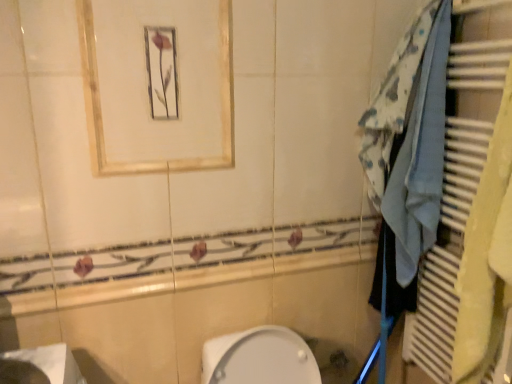
At what (x,y) coordinates should I click in order to perform the action: click on white glossy sink at lower left. Please return your answer as a coordinate pair (x, y). The height and width of the screenshot is (384, 512). Looking at the image, I should click on (49, 363).

Is point (425, 119) farther from viewer compared to point (68, 360)?

Yes, point (425, 119) is behind point (68, 360).

Can you confirm if blue fabric at right is smaller than white glossy sink at lower left?

Incorrect, blue fabric at right is not smaller in size than white glossy sink at lower left.

Considering the sizes of objects blue fabric at right and white glossy sink at lower left in the image provided, who is wider, blue fabric at right or white glossy sink at lower left?

Wider between the two is white glossy sink at lower left.

Is blue fabric towel at right facing away from matte gold frame at upper center?

No, blue fabric towel at right's orientation is not away from matte gold frame at upper center.

Are blue fabric towel at right and matte gold frame at upper center beside each other?

No, blue fabric towel at right is not with matte gold frame at upper center.

From the picture: Is blue fabric towel at right smaller than matte gold frame at upper center?

No, blue fabric towel at right is not smaller than matte gold frame at upper center.

Can you confirm if blue fabric at right is shorter than blue fabric towel at right?

In fact, blue fabric at right may be taller than blue fabric towel at right.

How many degrees apart are the facing directions of blue fabric at right and blue fabric towel at right?

The angle between the facing direction of blue fabric at right and the facing direction of blue fabric towel at right is 0.000786 degrees.

Is blue fabric at right positioned in front of blue fabric towel at right?

Yes, blue fabric at right is in front of blue fabric towel at right.

Locate an element on the screen. This screenshot has height=384, width=512. bath towel on the left of blue fabric at right is located at coordinates (420, 157).

Is the position of matte gold frame at upper center less distant than that of white glossy sink at lower left?

No, it is not.

From the image's perspective, which one is positioned higher, matte gold frame at upper center or white glossy sink at lower left?

matte gold frame at upper center.

Is matte gold frame at upper center inside or outside of white glossy sink at lower left?

The correct answer is: outside.

Is matte gold frame at upper center wider than white glossy sink at lower left?

No, matte gold frame at upper center is not wider than white glossy sink at lower left.

Do you think white glossy sink at lower left is within matte gold frame at upper center, or outside of it?

The correct answer is: outside.

Which is more to the right, white glossy sink at lower left or matte gold frame at upper center?

Positioned to the right is matte gold frame at upper center.

Identify the location of medicine cabinet located above the white glossy sink at lower left (from the image's perspective). Image resolution: width=512 pixels, height=384 pixels. (157, 84).

Can you tell me how much white glossy sink at lower left and matte gold frame at upper center differ in facing direction?

90 degrees separate the facing orientations of white glossy sink at lower left and matte gold frame at upper center.

From a real-world perspective, who is located lower, blue fabric towel at right or blue fabric at right?

From a 3D spatial view, blue fabric at right is below.

Considering the relative positions of blue fabric towel at right and blue fabric at right in the image provided, is blue fabric towel at right in front of blue fabric at right?

No, it is not.

Looking at the image, does blue fabric towel at right seem bigger or smaller compared to blue fabric at right?

In the image, blue fabric towel at right appears to be smaller than blue fabric at right.

Which of these two, blue fabric towel at right or blue fabric at right, stands shorter?

Standing shorter between the two is blue fabric towel at right.

From a real-world perspective, is matte gold frame at upper center beneath blue fabric at right?

No.

Does point (190, 97) appear closer or farther from the camera than point (441, 138)?

Point (190, 97).

Based on the photo, is matte gold frame at upper center turned away from blue fabric at right?

No.

Which of these two, matte gold frame at upper center or blue fabric at right, is smaller?

matte gold frame at upper center is smaller.

This screenshot has width=512, height=384. What are the coordinates of `closet that appears above the white glossy sink at lower left (from the image's perspective)` in the screenshot? It's located at (452, 196).

Locate an element on the screen. This screenshot has height=384, width=512. medicine cabinet to the left of blue fabric towel at right is located at coordinates (157, 84).

Considering their positions, is blue fabric towel at right positioned closer to white glossy sink at lower left than blue fabric at right?

blue fabric towel at right lies closer to white glossy sink at lower left than the other object.

Based on their spatial positions, is matte gold frame at upper center or blue fabric at right closer to white glossy sink at lower left?

Based on the image, matte gold frame at upper center appears to be nearer to white glossy sink at lower left.

Based on the photo, based on their spatial positions, is white glossy sink at lower left or blue fabric at right further from matte gold frame at upper center?

white glossy sink at lower left is further to matte gold frame at upper center.

Which object lies nearer to the anchor point matte gold frame at upper center, white glossy sink at lower left or blue fabric towel at right?

blue fabric towel at right is positioned closer to the anchor matte gold frame at upper center.

Which object lies nearer to the anchor point white glossy sink at lower left, blue fabric at right or blue fabric towel at right?

Among the two, blue fabric towel at right is located nearer to white glossy sink at lower left.

From the image, which object appears to be farther from white glossy sink at lower left, blue fabric towel at right or matte gold frame at upper center?

blue fabric towel at right lies further to white glossy sink at lower left than the other object.

Estimate the real-world distances between objects in this image. Which object is closer to matte gold frame at upper center, blue fabric towel at right or white glossy sink at lower left?

blue fabric towel at right is positioned closer to the anchor matte gold frame at upper center.

Estimate the real-world distances between objects in this image. Which object is further from blue fabric towel at right, blue fabric at right or matte gold frame at upper center?

matte gold frame at upper center is positioned further to the anchor blue fabric towel at right.

At what (x,y) coordinates should I click in order to perform the action: click on medicine cabinet between white glossy sink at lower left and blue fabric at right from left to right. Please return your answer as a coordinate pair (x, y). The height and width of the screenshot is (384, 512). Looking at the image, I should click on (157, 84).

Image resolution: width=512 pixels, height=384 pixels. Find the location of `bath towel situated between white glossy sink at lower left and blue fabric at right from left to right`. bath towel situated between white glossy sink at lower left and blue fabric at right from left to right is located at coordinates (420, 157).

Find the location of `medicine cabinet situated between white glossy sink at lower left and blue fabric towel at right from left to right`. medicine cabinet situated between white glossy sink at lower left and blue fabric towel at right from left to right is located at coordinates (157, 84).

This screenshot has height=384, width=512. I want to click on bath towel situated between matte gold frame at upper center and blue fabric at right from left to right, so click(420, 157).